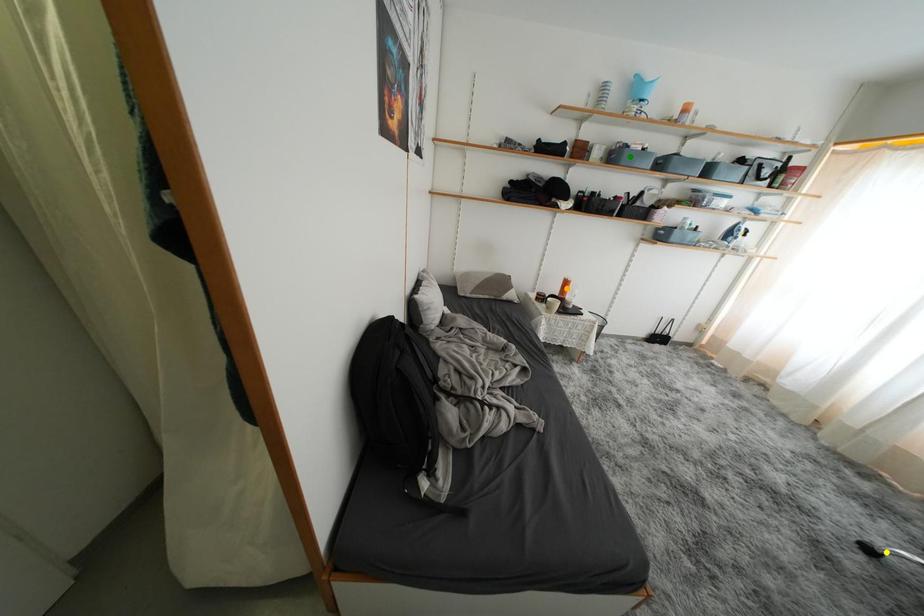
Order these from nearest to farthest:
green point
yellow point
orange point

orange point → green point → yellow point